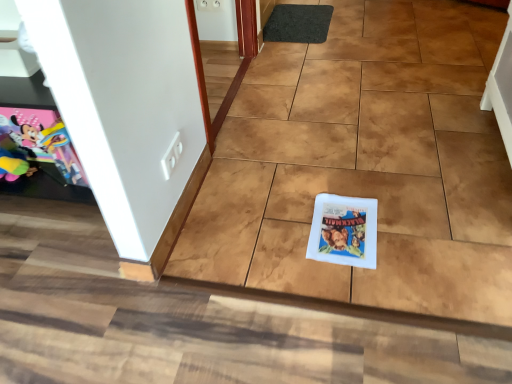
Locate an element on the screen. The height and width of the screenshot is (384, 512). free space on the front side of white paper comic book at center, acting as the second comic book starting from the left is located at coordinates (361, 286).